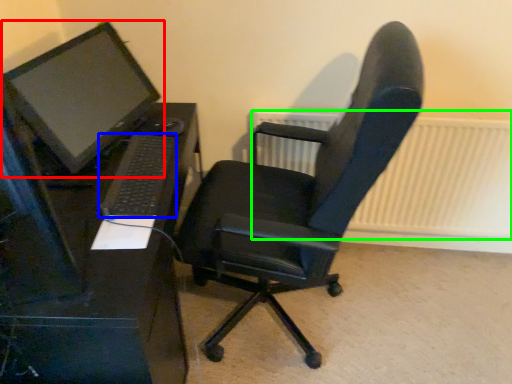
Question: Estimate the real-world distances between objects in this image. Which object is farther from computer monitor (highlighted by a red box), computer keyboard (highlighted by a blue box) or radiator (highlighted by a green box)?

Choices:
 (A) computer keyboard
 (B) radiator

Answer: (B)